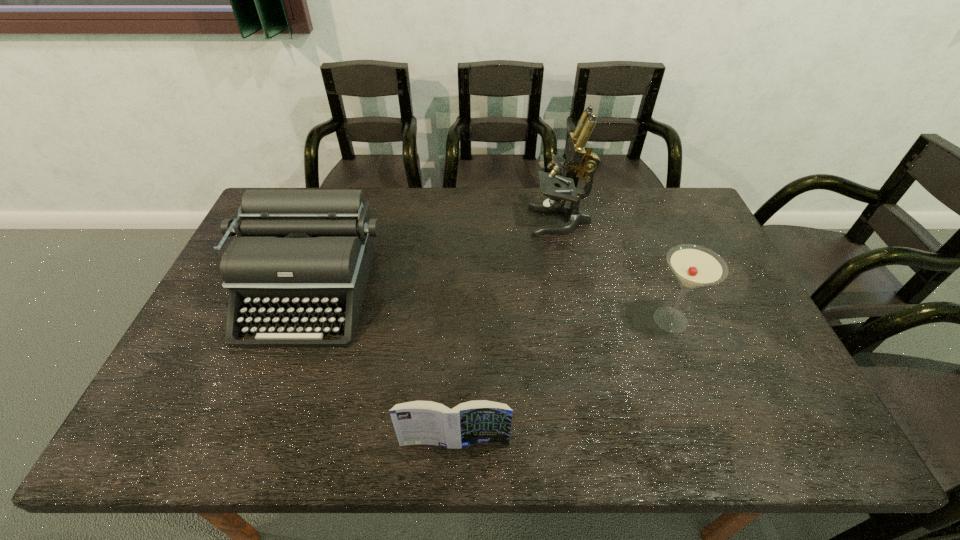
You are a GUI agent. You are given a task and a screenshot of the screen. Output one action in this format:
    pyautogui.click(x=<x>, y=<y>)
    Task: Click on the free location located on the left of the rightmost object
    The height and width of the screenshot is (540, 960).
    Given the screenshot: What is the action you would take?
    pyautogui.click(x=497, y=320)

You are a GUI agent. You are given a task and a screenshot of the screen. Output one action in this format:
    pyautogui.click(x=<x>, y=<y>)
    Task: Click on the object that is at the far edge
    The image size is (960, 540).
    Given the screenshot: What is the action you would take?
    pyautogui.click(x=579, y=153)

Find the location of a particular element. object located at the near edge is located at coordinates (x=418, y=422).

This screenshot has height=540, width=960. Find the location of `object present at the left edge`. object present at the left edge is located at coordinates (301, 252).

At what (x,y) coordinates should I click in order to perform the action: click on object that is at the right edge. Please return your answer as a coordinate pair (x, y). Image resolution: width=960 pixels, height=540 pixels. Looking at the image, I should click on (694, 266).

The image size is (960, 540). What are the coordinates of `free space at the far edge of the desktop` in the screenshot? It's located at (413, 204).

In the image, there is a desktop. Where is `free space at the near edge`? The image size is (960, 540). free space at the near edge is located at coordinates (232, 434).

Identify the location of vacant region at the left edge. The image size is (960, 540). (168, 385).

Locate an element on the screen. Image resolution: width=960 pixels, height=540 pixels. blank space at the right edge of the desktop is located at coordinates (749, 305).

Where is `vacant area that lies between the third object from right to left and the leftmost object`? This screenshot has width=960, height=540. vacant area that lies between the third object from right to left and the leftmost object is located at coordinates (381, 368).